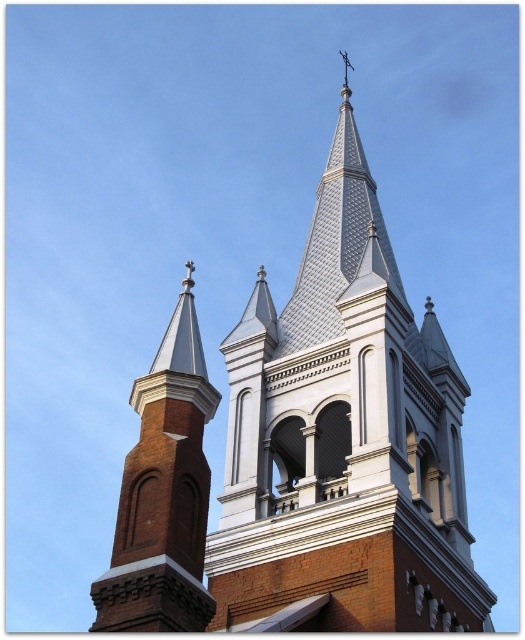
Based on the photo, you are standing in front of the church and want to take a photo of both the white textured steeple at center and the red brick tower at left. Which direction should you turn your camera to include both in the frame?

You should turn your camera to the left to include both the white textured steeple at center and the red brick tower at left in the frame since the white textured steeple at center is to the right of the red brick tower at left.

You are standing in front of the church and notice two points marked on the steeple and the main body. Which point is closer to you, point (443, 428) or point (175, 548)?

Point (443, 428) is further to the viewer than point (175, 548), so point (175, 548) is closer to you.

You are a photographer planning to capture the church from a distance. You want to ensure both the white textured steeple at center and the red brick tower at left are clearly visible in your shot. Given their heights, which one will appear larger in the photograph?

The white textured steeple at center is much taller than the red brick tower at left, so it will appear larger in the photograph due to its greater height.